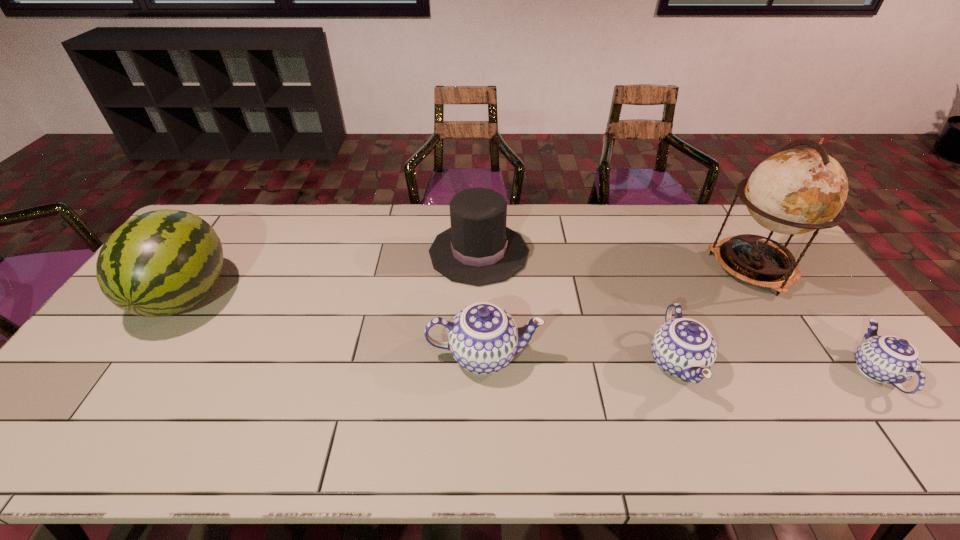
Identify the location of the tallest chinaware. The image size is (960, 540). (483, 338).

Locate an element on the screen. This screenshot has height=540, width=960. the second chinaware from right to left is located at coordinates (682, 347).

Locate an element on the screen. This screenshot has height=540, width=960. the fifth tallest object is located at coordinates (682, 347).

You are a GUI agent. You are given a task and a screenshot of the screen. Output one action in this format:
    pyautogui.click(x=<x>, y=<y>)
    Task: Click on the rightmost chinaware
    The width and height of the screenshot is (960, 540).
    Given the screenshot: What is the action you would take?
    pyautogui.click(x=889, y=359)

Where is `the shortest object`? the shortest object is located at coordinates (889, 359).

In order to click on dress hat in this screenshot , I will do `click(478, 249)`.

In order to click on the fifth shortest object in this screenshot , I will do `click(160, 263)`.

This screenshot has width=960, height=540. In order to click on the leftmost object in this screenshot , I will do `click(160, 263)`.

This screenshot has height=540, width=960. I want to click on the tallest object, so pos(795,191).

Locate an element on the screen. This screenshot has width=960, height=540. vacant space situated at the spout of the tallest chinaware is located at coordinates (570, 355).